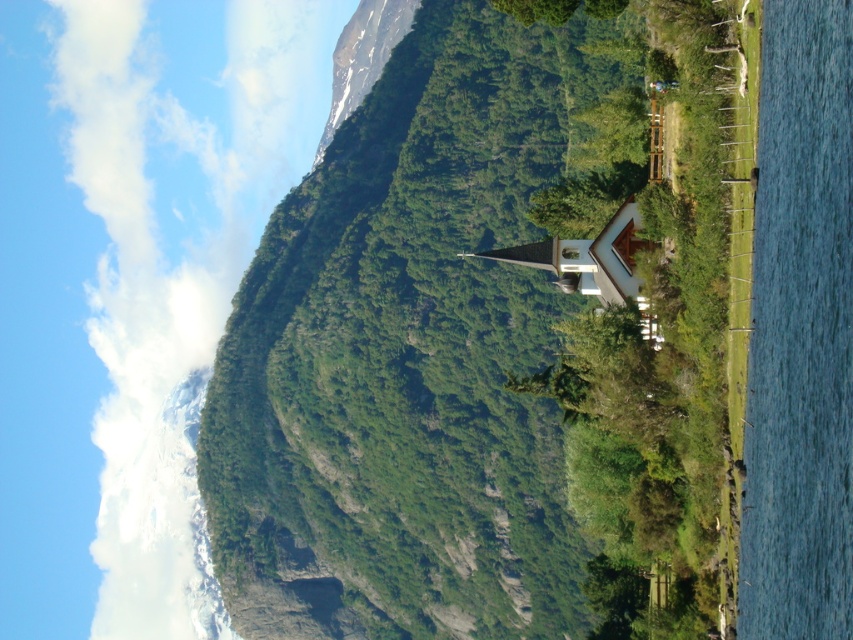
You are standing at the point with coordinates point (654,336) and want to walk towards the point with coordinates point (595,531). Based on the scene description, will you have to go through any obstacles like trees or buildings along the way?

Point (595,531) is behind point (654,336), so you will have to go through the dense vegetation surrounding the small building with a pointed roof in the foreground to reach it.

You are standing in front of the white wooden chapel at center and want to take a photo of the green textured mountain at center. Which direction should you face to capture the mountain in your photo?

The green textured mountain at center is to the right of the white wooden chapel at center, so you should face to the right to capture the mountain in your photo.

You are planning to build a hiking trail that starts from the white wooden chapel at center and goes towards the green textured mountain at center. Considering the spatial relationship between these two objects, which direction should the trail primarily head to reach the mountain?

The trail should head towards the green textured mountain at center since it is located at the same central area as the white wooden chapel at center, but the mountain is wider, so the trail can extend towards the mountain by following the central path where both objects are positioned.